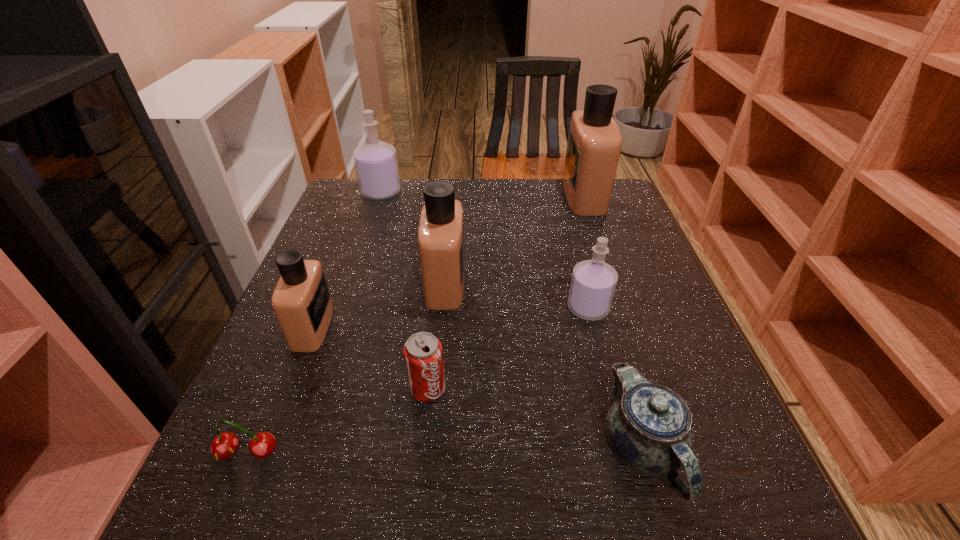
You are a GUI agent. You are given a task and a screenshot of the screen. Output one action in this format:
    pyautogui.click(x=<x>, y=<y>)
    Task: Click on the free spot at the right edge of the desktop
    This screenshot has width=960, height=540.
    Given the screenshot: What is the action you would take?
    tap(616, 256)

What are the coordinates of `vacant space at the far left corner of the desktop` in the screenshot? It's located at (378, 202).

In the image, there is a desktop. Identify the location of free region at the near right corner. (740, 532).

The image size is (960, 540). In order to click on free area in between the left purple perfume and the smaller purple perfume in this screenshot , I will do `click(485, 250)`.

Locate an element on the screen. The width and height of the screenshot is (960, 540). vacant point located between the chinaware and the farther purple perfume is located at coordinates (512, 321).

The image size is (960, 540). Find the location of `unoccupied position between the leftmost beige perfume and the pink soda can`. unoccupied position between the leftmost beige perfume and the pink soda can is located at coordinates (371, 358).

The height and width of the screenshot is (540, 960). Find the location of `free space between the pink soda can and the farther purple perfume`. free space between the pink soda can and the farther purple perfume is located at coordinates (404, 291).

This screenshot has width=960, height=540. What are the coordinates of `free space that is in between the red cherry and the pink soda can` in the screenshot? It's located at (338, 421).

Identify the location of free space that is in between the chinaware and the right purple perfume. (614, 379).

You are a GUI agent. You are given a task and a screenshot of the screen. Output one action in this format:
    pyautogui.click(x=<x>, y=<y>)
    Task: Click on the free space between the biggest beige perfume and the cherry
    The width and height of the screenshot is (960, 540).
    Given the screenshot: What is the action you would take?
    pyautogui.click(x=416, y=325)